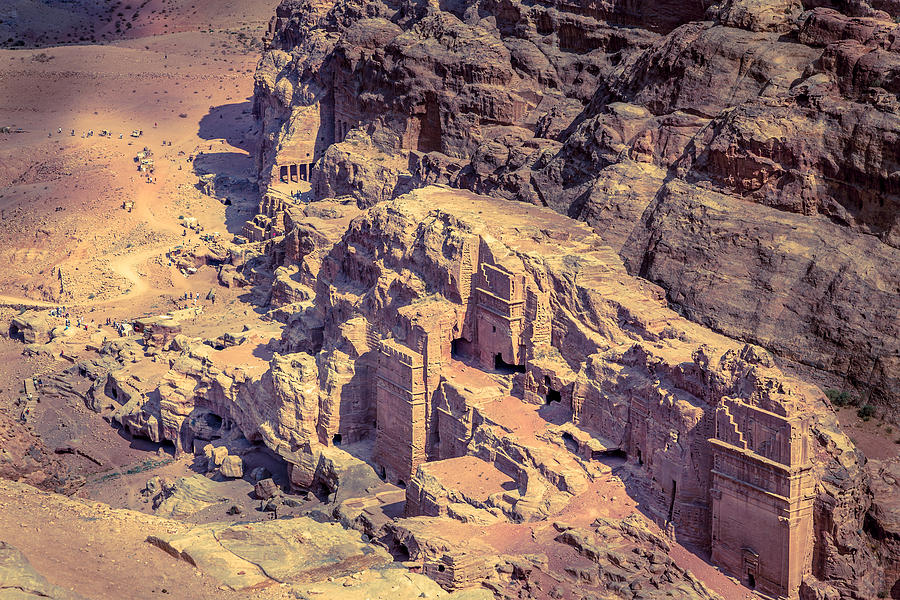
Identify the location of doorways. This screenshot has width=900, height=600. (751, 582), (401, 486), (380, 473), (335, 439), (637, 455), (669, 506).